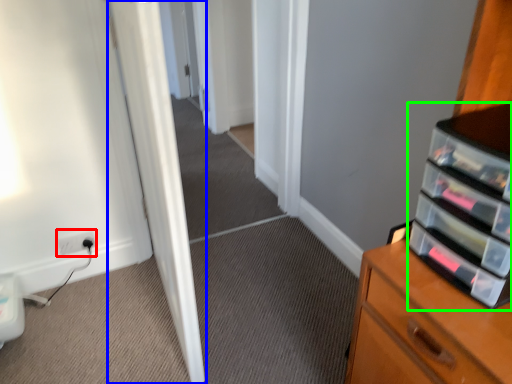
Question: Which is nearer to the electric outlet (highlighted by a red box)? door (highlighted by a blue box) or shelf (highlighted by a green box).

Choices:
 (A) door
 (B) shelf

Answer: (A)